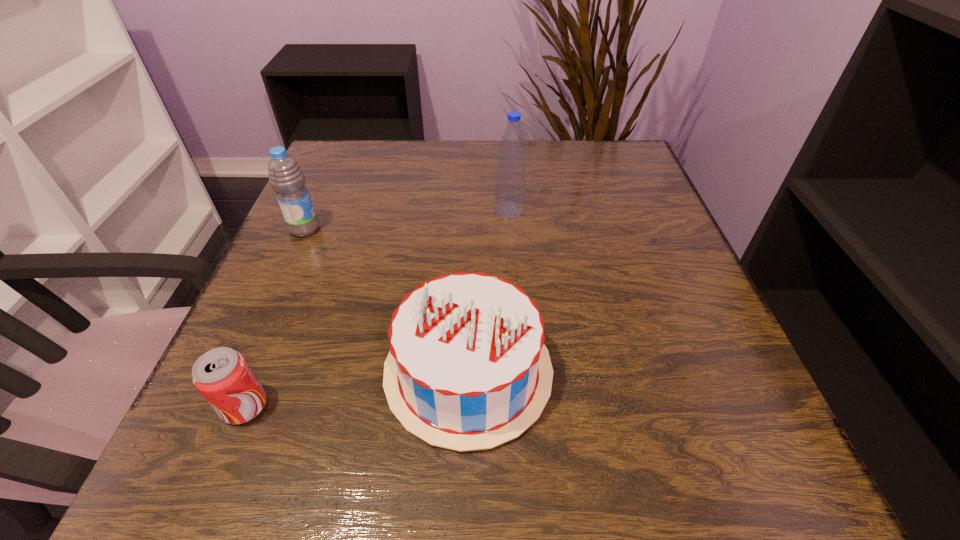
What are the coordinates of `free space at the near right corner` in the screenshot? It's located at (696, 432).

Locate an element on the screen. This screenshot has height=540, width=960. vacant space in between the soda can and the farther water bottle is located at coordinates (377, 308).

I want to click on vacant area between the birthday cake and the shorter water bottle, so click(x=387, y=300).

Where is `free space between the birthday cake and the shortest object`? Image resolution: width=960 pixels, height=540 pixels. free space between the birthday cake and the shortest object is located at coordinates (356, 388).

At what (x,y) coordinates should I click in order to perform the action: click on free point between the birthday cake and the soda can. Please return your answer as a coordinate pair (x, y). The image size is (960, 540). Looking at the image, I should click on (356, 388).

At what (x,y) coordinates should I click in order to perform the action: click on free space between the second farthest object and the shortest object. Please return your answer as a coordinate pair (x, y). This screenshot has height=540, width=960. Looking at the image, I should click on (275, 318).

Where is `unoccupied position between the farthest object and the second tallest object`? The height and width of the screenshot is (540, 960). unoccupied position between the farthest object and the second tallest object is located at coordinates (407, 219).

You are a GUI agent. You are given a task and a screenshot of the screen. Output one action in this format:
    pyautogui.click(x=<x>, y=<y>)
    Task: Click on the unoccupied area between the soda can and the tallest object
    Image resolution: width=960 pixels, height=540 pixels.
    Given the screenshot: What is the action you would take?
    pyautogui.click(x=377, y=308)

This screenshot has height=540, width=960. Identify the location of vacant area that lies between the second shortest object and the second farthest object. point(387,300).

The width and height of the screenshot is (960, 540). What are the coordinates of `vacant area that lies between the second shortest object and the left water bottle` in the screenshot? It's located at (387, 300).